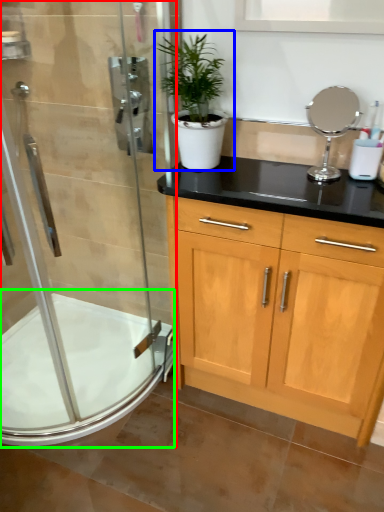
Question: Which object is positioned closest to shower door (highlighted by a red box)? Select from houseplant (highlighted by a blue box) and bath (highlighted by a green box).

Choices:
 (A) houseplant
 (B) bath

Answer: (B)